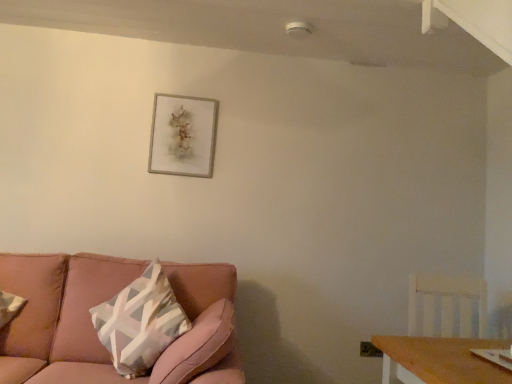
Question: From a real-world perspective, is silver metallic picture frame at upper center located higher than pink fabric couch at lower left?

Choices:
 (A) yes
 (B) no

Answer: (A)

Question: From the image's perspective, does silver metallic picture frame at upper center appear lower than pink fabric couch at lower left?

Choices:
 (A) no
 (B) yes

Answer: (A)

Question: From the image's perspective, would you say silver metallic picture frame at upper center is positioned over pink fabric couch at lower left?

Choices:
 (A) yes
 (B) no

Answer: (A)

Question: Is silver metallic picture frame at upper center to the left of pink fabric couch at lower left from the viewer's perspective?

Choices:
 (A) no
 (B) yes

Answer: (A)

Question: Is silver metallic picture frame at upper center in contact with pink fabric couch at lower left?

Choices:
 (A) yes
 (B) no

Answer: (B)

Question: Is silver metallic picture frame at upper center not close to pink fabric couch at lower left?

Choices:
 (A) no
 (B) yes

Answer: (A)

Question: Is pink fabric couch at lower left at the right side of silver metallic picture frame at upper center?

Choices:
 (A) no
 (B) yes

Answer: (A)

Question: Is pink fabric couch at lower left positioned beyond the bounds of silver metallic picture frame at upper center?

Choices:
 (A) yes
 (B) no

Answer: (A)

Question: From a real-world perspective, is pink fabric couch at lower left beneath silver metallic picture frame at upper center?

Choices:
 (A) yes
 (B) no

Answer: (A)

Question: Does pink fabric couch at lower left have a smaller size compared to silver metallic picture frame at upper center?

Choices:
 (A) no
 (B) yes

Answer: (A)

Question: Considering the relative sizes of pink fabric couch at lower left and silver metallic picture frame at upper center in the image provided, is pink fabric couch at lower left wider than silver metallic picture frame at upper center?

Choices:
 (A) no
 (B) yes

Answer: (B)

Question: From the image's perspective, is pink fabric couch at lower left on silver metallic picture frame at upper center?

Choices:
 (A) yes
 (B) no

Answer: (B)

Question: Is white wood swivel chair at right facing towards silver metallic picture frame at upper center?

Choices:
 (A) yes
 (B) no

Answer: (B)